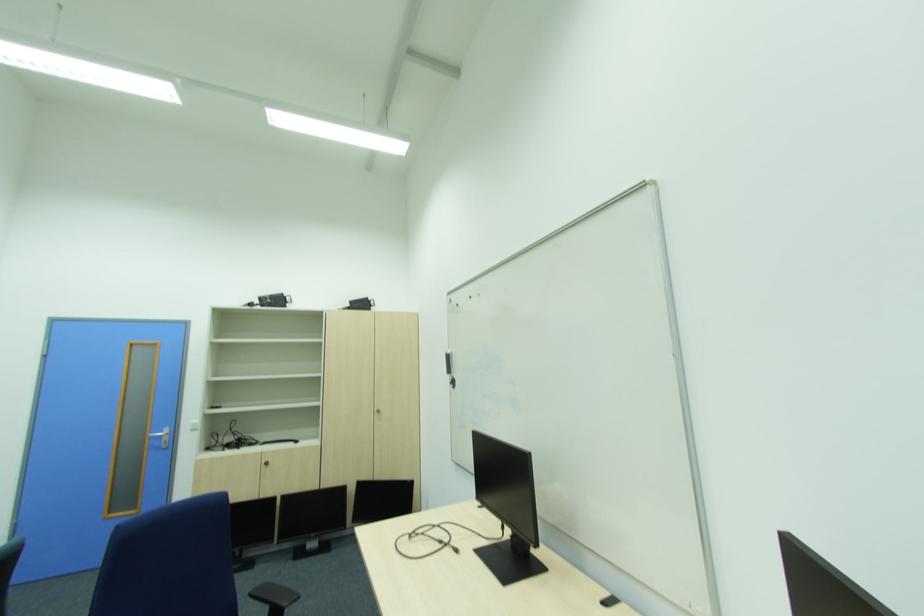
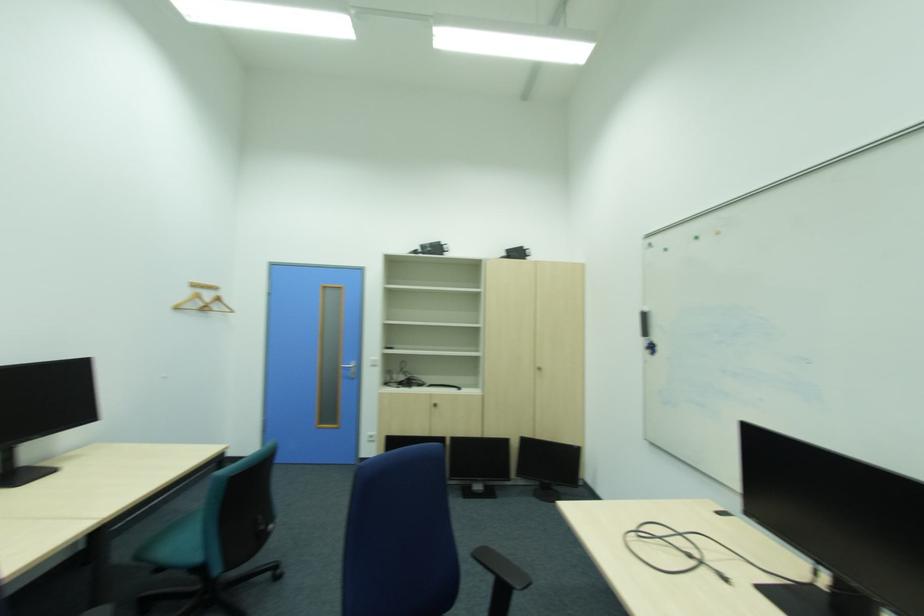
Question: How did the camera likely rotate?

Choices:
 (A) Left
 (B) Right
 (C) Up
 (D) Down

Answer: (A)